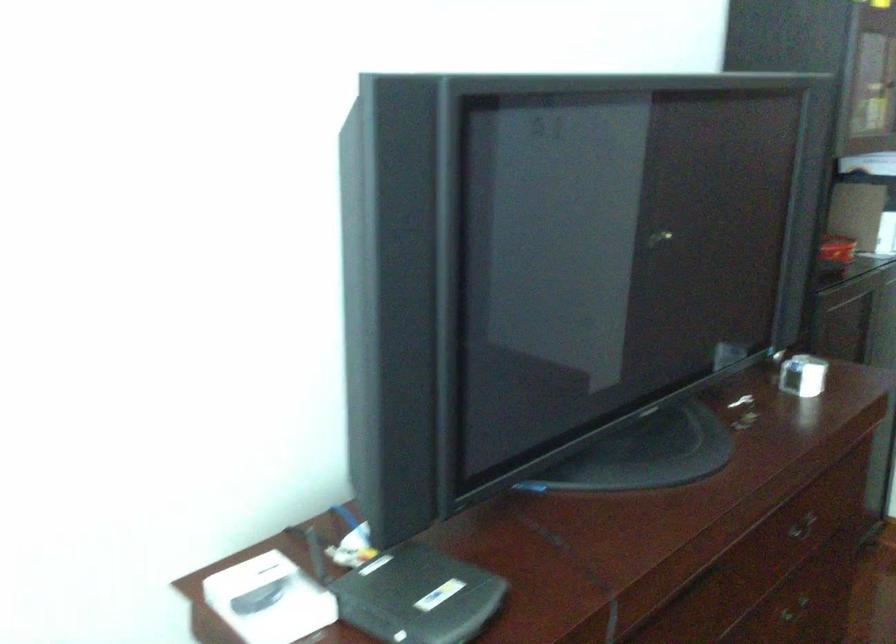
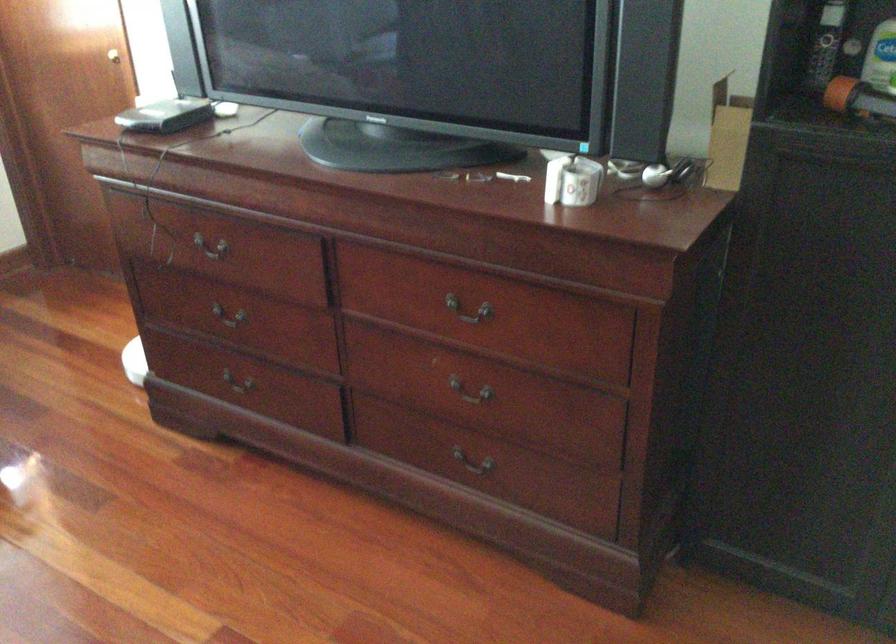
Locate, in the second image, the point that corresponds to (x=791, y=377) in the first image.

(572, 180)